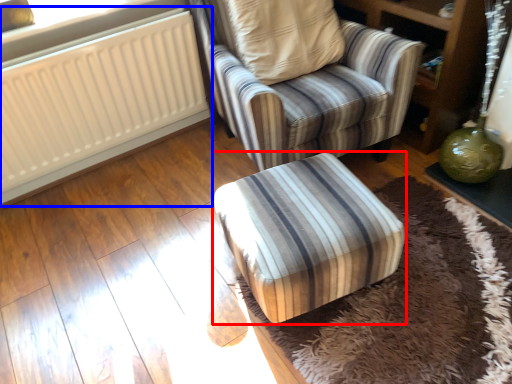
Question: Which point is further to the camera, furniture (highlighted by a red box) or radiator (highlighted by a blue box)?

Choices:
 (A) furniture
 (B) radiator

Answer: (B)